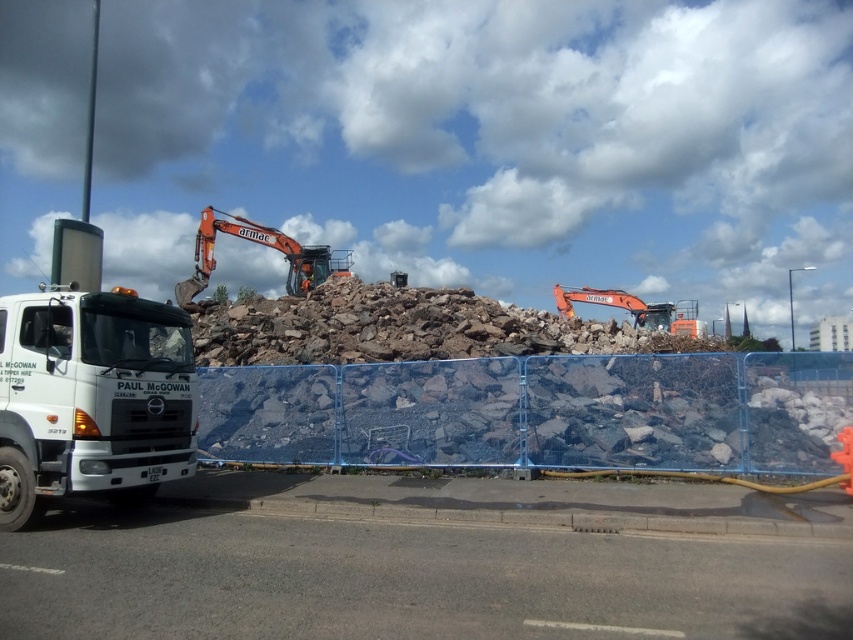
You are a delivery driver who needs to enter the construction site through the blue plastic fence at center. The orange metallic excavator at upper center is blocking your path. Can you drive around it to reach the fence?

The blue plastic fence at center is below the orange metallic excavator at upper center, so the excavator is positioned higher up in the image. You can drive around it to reach the fence.

In the scene shown: You are a safety inspector standing at the camera position. You need to check the distance between the blue plastic fence at center and the camera to ensure it meets the safety regulation of 10 meters. Is the distance compliant?

The distance between the blue plastic fence at center and the camera is 9.20 meters, which is less than the required 10 meters. Therefore, it does not comply with the safety regulations.

You are a delivery driver who needs to park your truck near the white matte truck at left without blocking the entrance. The entrance is located at the point marked by the coordinate (90, 387). Can you park your truck safely here?

The point (90, 387) marks the white matte truck at left, so parking there would place your truck directly at the entrance, blocking it. Choose a different spot.